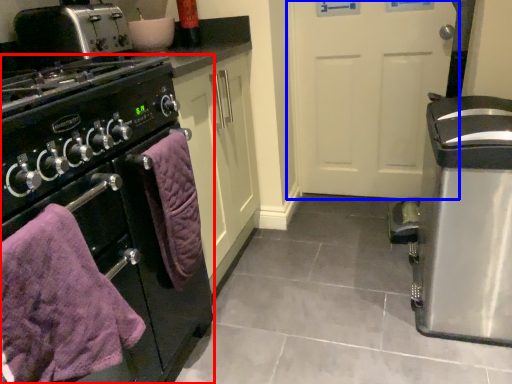
Question: Which object is further to the camera taking this photo, home appliance (highlighted by a red box) or door (highlighted by a blue box)?

Choices:
 (A) home appliance
 (B) door

Answer: (B)